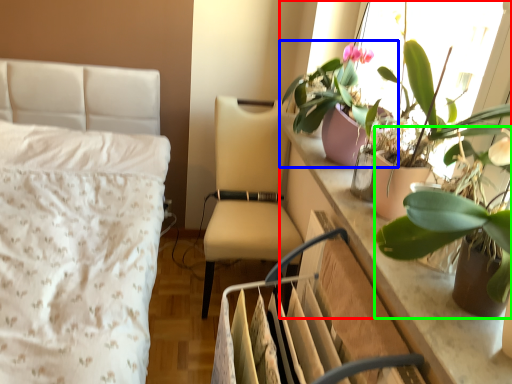
Question: Which object is positioned closest to houseplant (highlighted by a red box)? Select from houseplant (highlighted by a blue box) and houseplant (highlighted by a green box).

Choices:
 (A) houseplant
 (B) houseplant

Answer: (B)